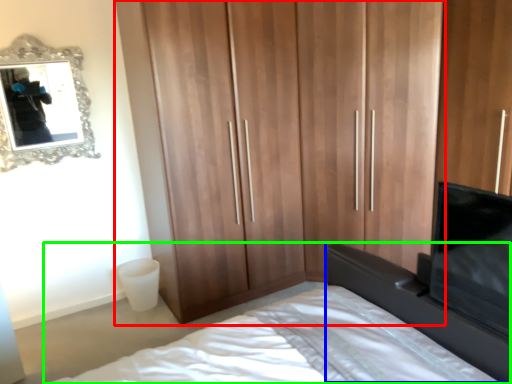
Question: Based on their relative distances, which object is nearer to cupboard (highlighted by a red box)? Choose from vanity (highlighted by a blue box) and bed (highlighted by a green box).

Choices:
 (A) vanity
 (B) bed

Answer: (B)